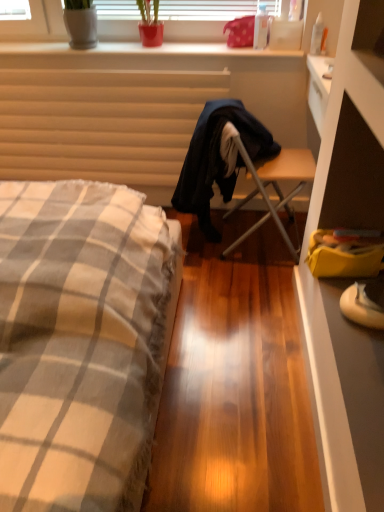
This screenshot has height=512, width=384. I want to click on vacant area to the left of transparent plastic bottle at upper center, the second bottle viewed from the right, so click(226, 49).